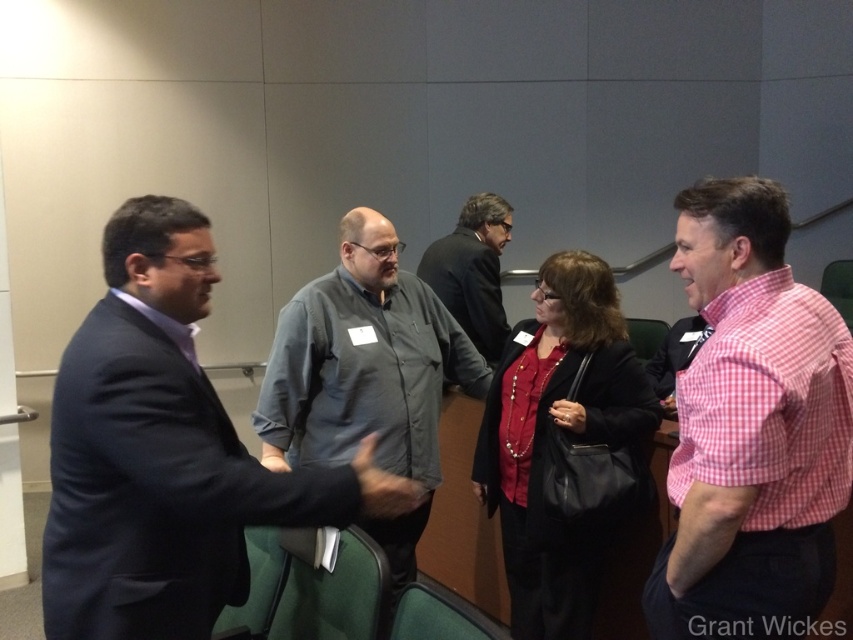
You are a photographer positioned at the center of the room. You need to take a photo of the pink checkered shirt at right and the dark brown suit jacket at center. Given that your camera has a maximum focus range of 1.8 meters, will both subjects be in focus?

The pink checkered shirt at right is 1.89 meters away from dark brown suit jacket at center. Since the distance between them exceeds the camera focus range of 1.8 meters, both subjects cannot be in focus simultaneously.

You are organizing a photo shoot and need to arrange two models based on their height. You have a pink checkered shirt at right and a dark brown suit jacket at center. Which model should stand in front to ensure both are visible?

The pink checkered shirt at right is taller than the dark brown suit jacket at center, so the dark brown suit jacket at center should stand in front to ensure both are visible.